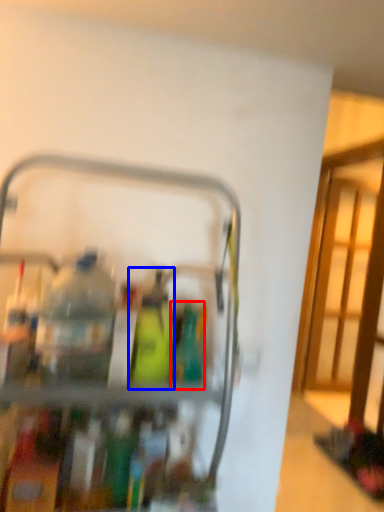
Question: Which object is further to the camera taking this photo, bottle (highlighted by a red box) or bottle (highlighted by a blue box)?

Choices:
 (A) bottle
 (B) bottle

Answer: (A)